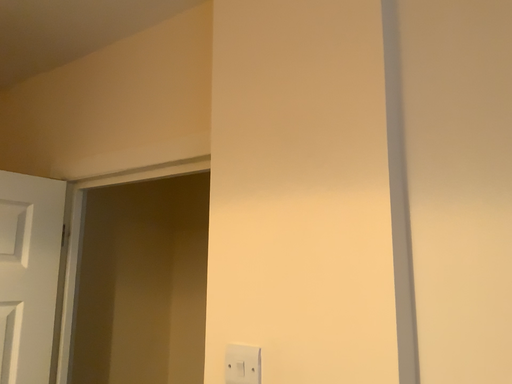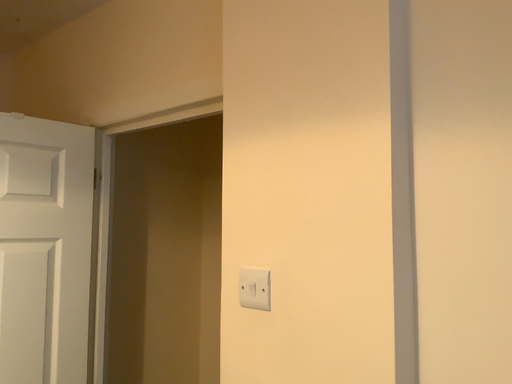
Question: How did the camera likely rotate when shooting the video?

Choices:
 (A) rotated upward
 (B) rotated downward

Answer: (B)